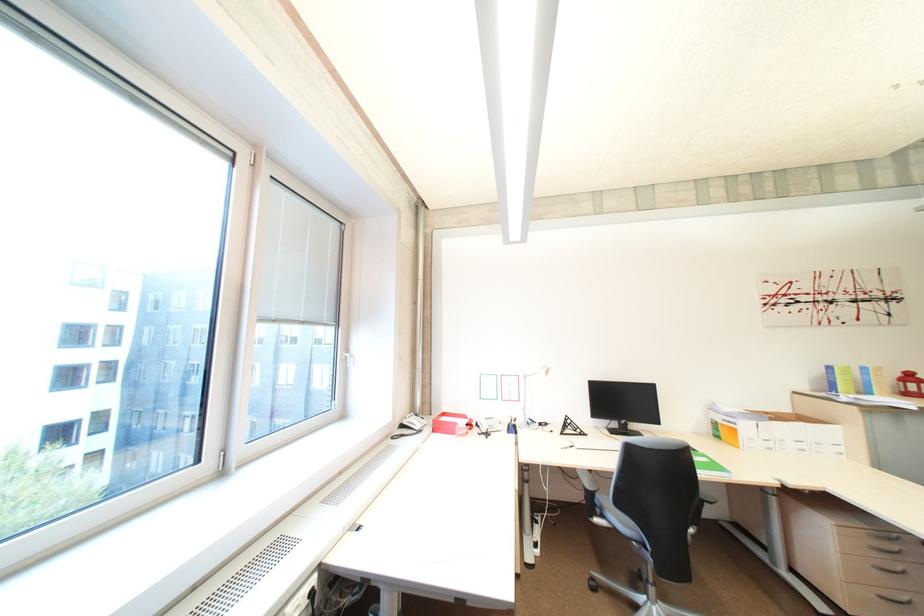
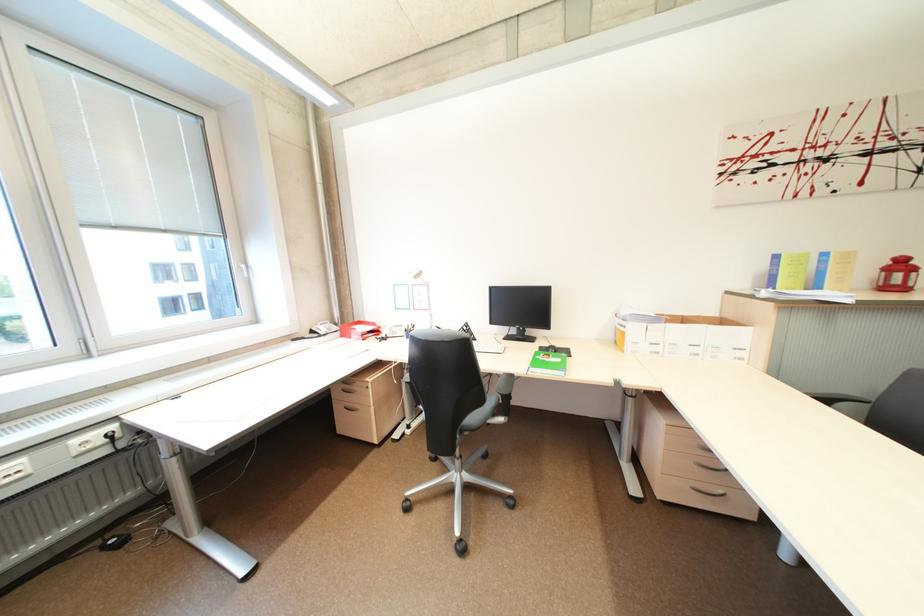
Where in the second image is the point corresponding to the point at 839,369 from the first image?

(785, 257)